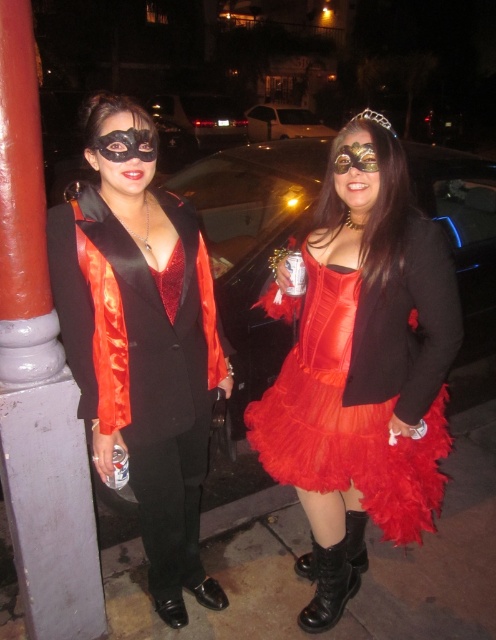
Is satin black vest at left closer to camera compared to shiny satin dress at center?

Yes.

Can you confirm if satin black vest at left is bigger than shiny satin dress at center?

Indeed, satin black vest at left has a larger size compared to shiny satin dress at center.

This screenshot has height=640, width=496. Identify the location of satin black vest at left. (141, 340).